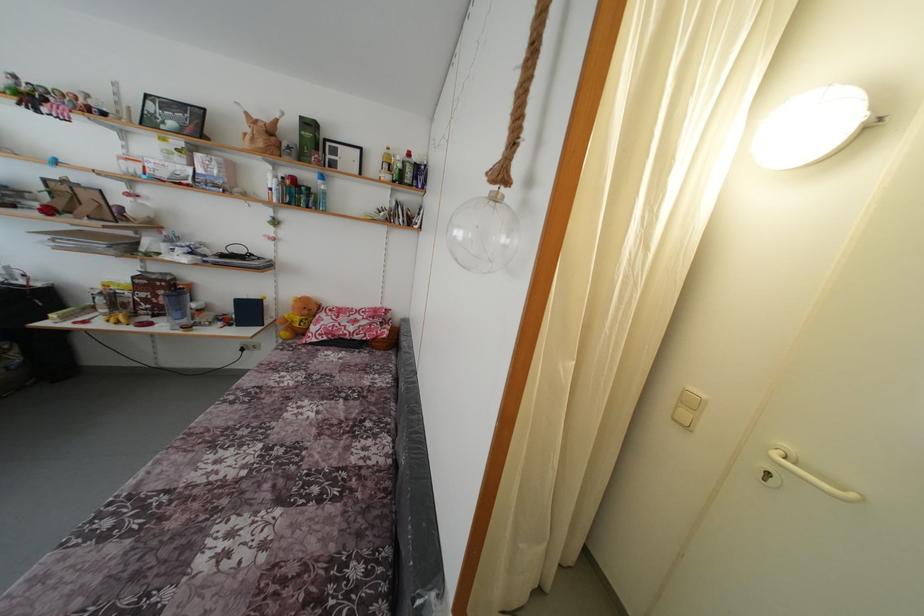
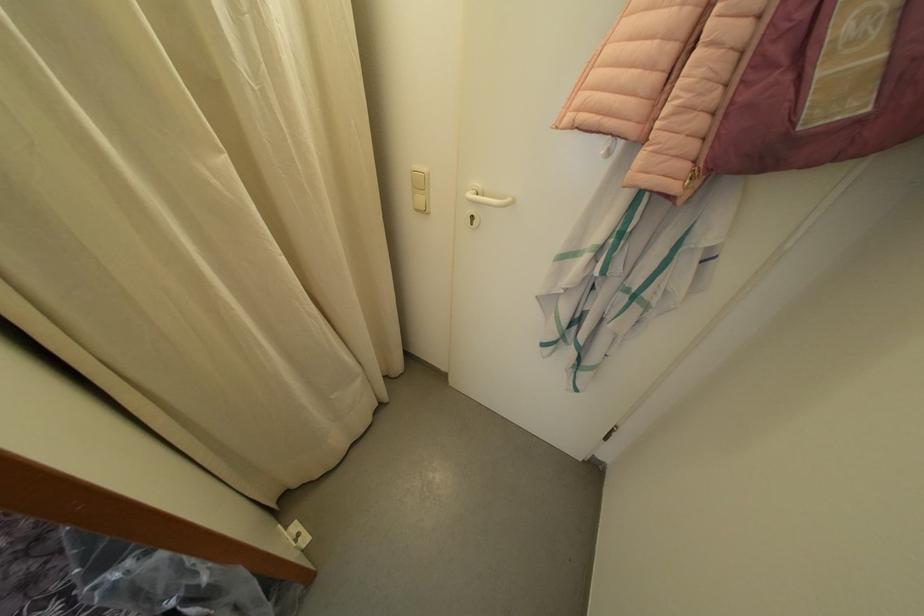
Where in the second image is the point corresponding to pixel 794 454 from the first image?

(482, 190)